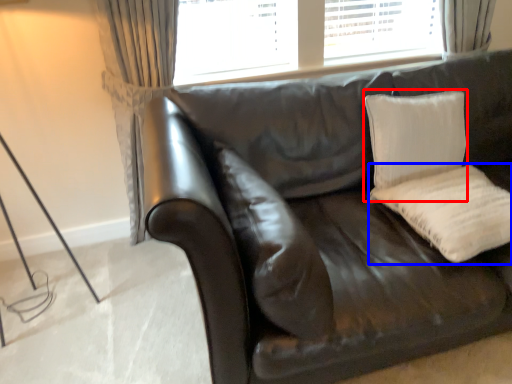
Question: Which of the following is the closest to the observer, pillow (highlighted by a red box) or pillow (highlighted by a blue box)?

Choices:
 (A) pillow
 (B) pillow

Answer: (B)